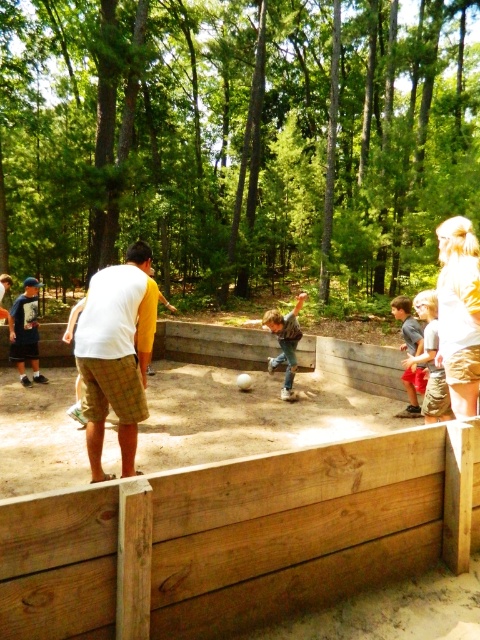
Can you confirm if gray cotton shirt at center is shorter than matte blue shirt at left?

Yes, gray cotton shirt at center is shorter than matte blue shirt at left.

Does point (432, 369) come closer to viewer compared to point (19, 317)?

Yes, it is in front of point (19, 317).

The height and width of the screenshot is (640, 480). What do you see at coordinates (431, 360) in the screenshot?
I see `gray cotton shirt at center` at bounding box center [431, 360].

Locate an element on the screen. This screenshot has width=480, height=640. gray cotton shirt at center is located at coordinates (431, 360).

Does gray cotton shirt at center have a larger size compared to jeans at center?

Yes, gray cotton shirt at center is bigger than jeans at center.

Can you confirm if gray cotton shirt at center is positioned to the right of jeans at center?

Yes, gray cotton shirt at center is to the right of jeans at center.

Which is behind, point (419, 292) or point (294, 340)?

Positioned behind is point (419, 292).

The height and width of the screenshot is (640, 480). I want to click on gray cotton shirt at center, so click(431, 360).

Does point (407, 413) lie behind point (279, 362)?

No, (407, 413) is closer to viewer.

Which is in front, point (418, 349) or point (276, 332)?

Point (418, 349)

I want to click on denim shorts at lower right, so click(408, 324).

This screenshot has height=640, width=480. Identify the location of denim shorts at lower right. (408, 324).